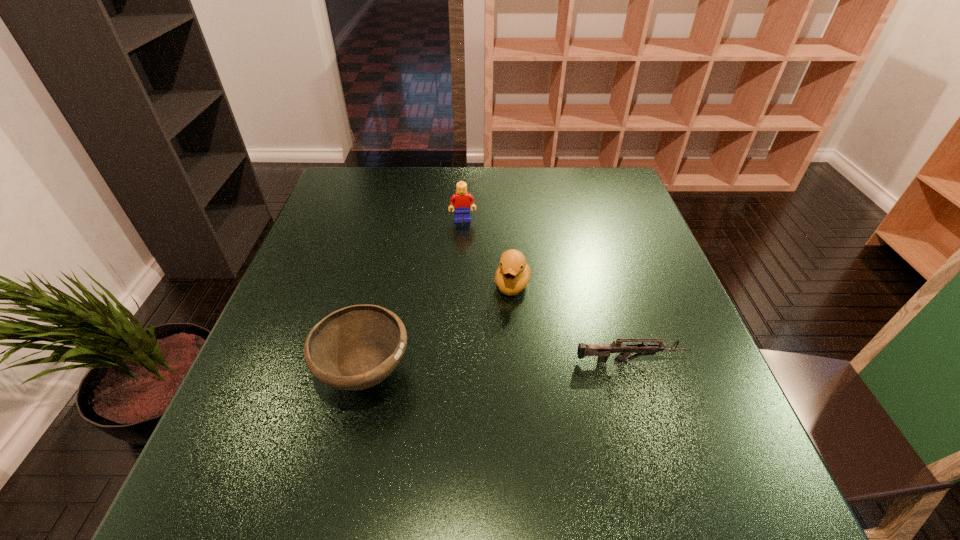
Locate an element on the screen. The image size is (960, 540). free space between the farthest object and the leftmost object is located at coordinates (414, 296).

You are a GUI agent. You are given a task and a screenshot of the screen. Output one action in this format:
    pyautogui.click(x=<x>, y=<y>)
    Task: Click on the free space between the shortest object and the leftmost object
    
    Given the screenshot: What is the action you would take?
    pyautogui.click(x=497, y=367)

Find the location of a particular element. blank region between the duckling and the farthest object is located at coordinates [x=488, y=252].

At what (x,y) coordinates should I click in order to perform the action: click on empty space that is in between the leftmost object and the shortest object. Please return your answer as a coordinate pair (x, y). The image size is (960, 540). Looking at the image, I should click on (497, 367).

The height and width of the screenshot is (540, 960). I want to click on object that stands as the third closest to the gun, so click(x=460, y=199).

Locate which object ranks in proximity to the duckling. Please provide its 2D coordinates. Your answer should be formatted as a tuple, i.e. [(x, y)], where the tuple contains the x and y coordinates of a point satisfying the conditions above.

[(603, 351)]

Locate an element on the screen. Image resolution: width=960 pixels, height=540 pixels. free space that satisfies the following two spatial constraints: 1. on the back side of the rightmost object; 2. aimed along the barrel of the bowl is located at coordinates (368, 361).

I want to click on free spot that satisfies the following two spatial constraints: 1. on the front side of the Lego; 2. aimed along the barrel of the shortest object, so click(456, 361).

Image resolution: width=960 pixels, height=540 pixels. I want to click on free point that satisfies the following two spatial constraints: 1. on the front side of the rightmost object; 2. aimed along the barrel of the duckling, so click(518, 361).

You are a GUI agent. You are given a task and a screenshot of the screen. Output one action in this format:
    pyautogui.click(x=<x>, y=<y>)
    Task: Click on the vacant region that satisfies the following two spatial constraints: 1. on the back side of the bowl; 2. aimed along the barrel of the shortest object
    This screenshot has height=540, width=960.
    Given the screenshot: What is the action you would take?
    pyautogui.click(x=368, y=361)